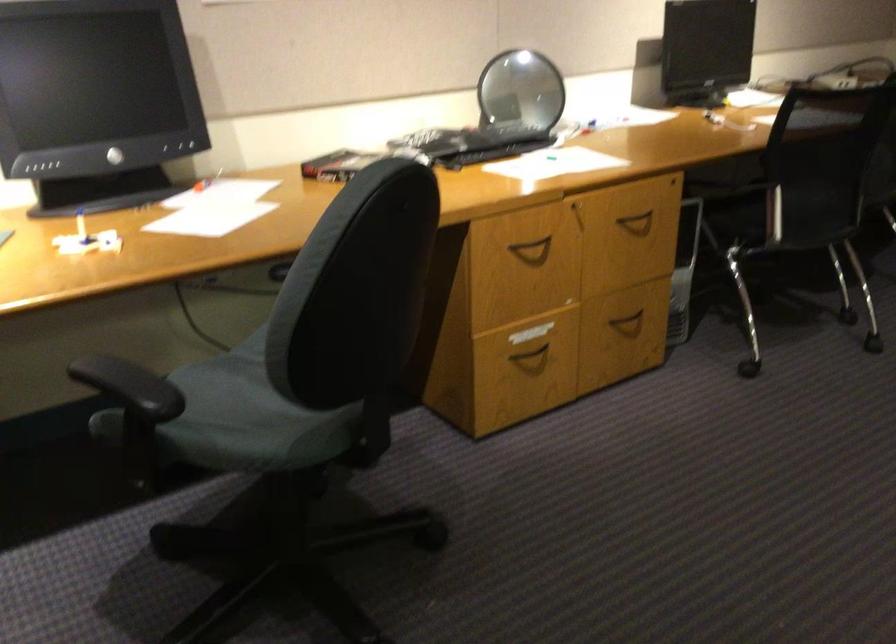
Where would you resting arm the chair armrest? Please return your answer as a coordinate pair (x, y).

(130, 386)